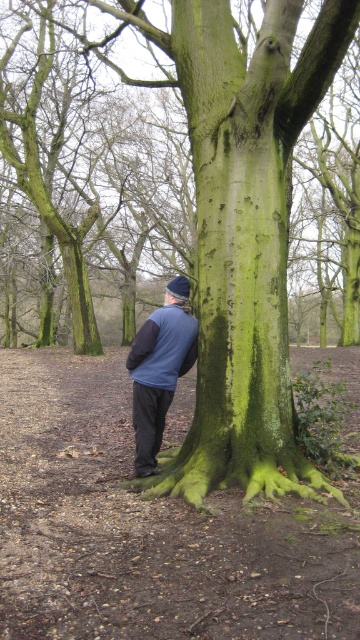
You are a hiker who wants to place a marker exactly at the center of the forest scene. Given the coordinates provided, where should you place the marker relative to the blue fleece jacket at center?

The blue fleece jacket at center is located at coordinates point (159, 369). To place the marker at the exact center of the forest scene, you would need to position it at the same coordinates as the blue fleece jacket at center since it is already at the center point.

Based on the photo, you are trying to decide which clothing item to wear for a cold day. You see the blue fleece jacket at center and the blue fleece sweatshirt at lower center in the image. Which one is more suitable for keeping warm?

The blue fleece sweatshirt at lower center is thicker than the blue fleece jacket at center, so it would be more suitable for keeping warm on a cold day.

You are a hiker trying to decide which clothing item to wear for warmth. You have a blue fleece jacket at center and a blue fleece sweatshirt at lower center. Which one is taller?

The blue fleece sweatshirt at lower center is taller than the blue fleece jacket at center.